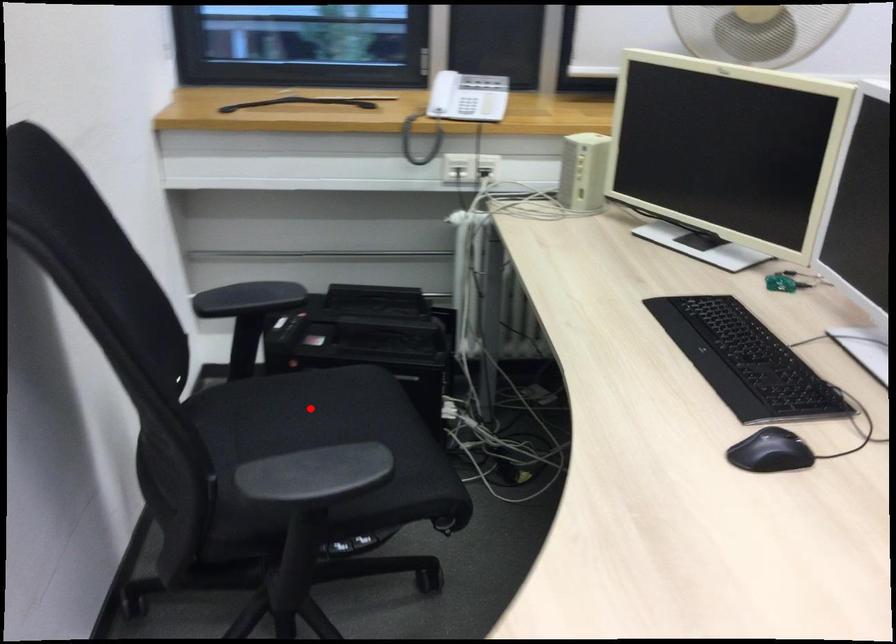
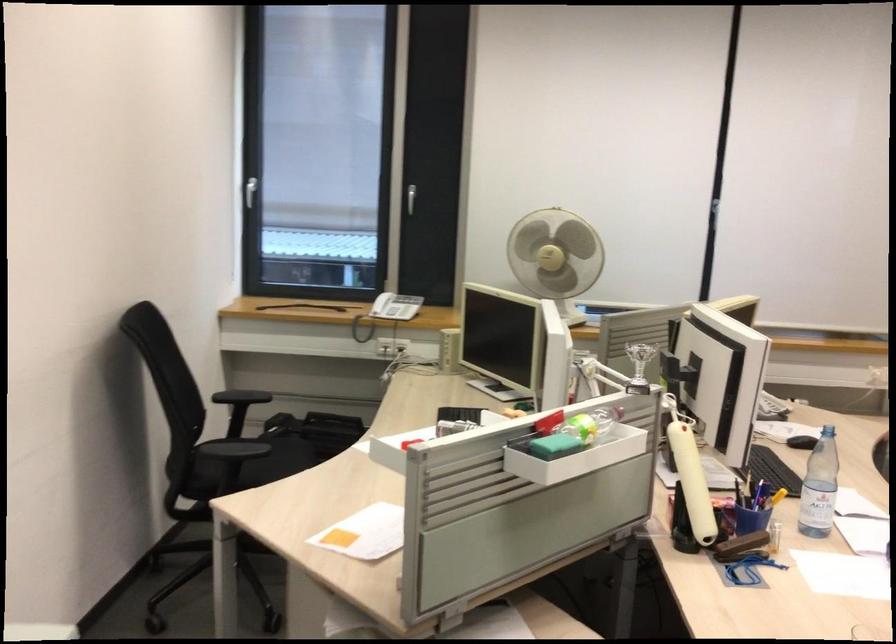
Question: I am providing you with two images of the same scene from different viewpoints. A red point is marked on the first image. Can you still see the location of the red point in image 2?

Choices:
 (A) Yes
 (B) No

Answer: (B)